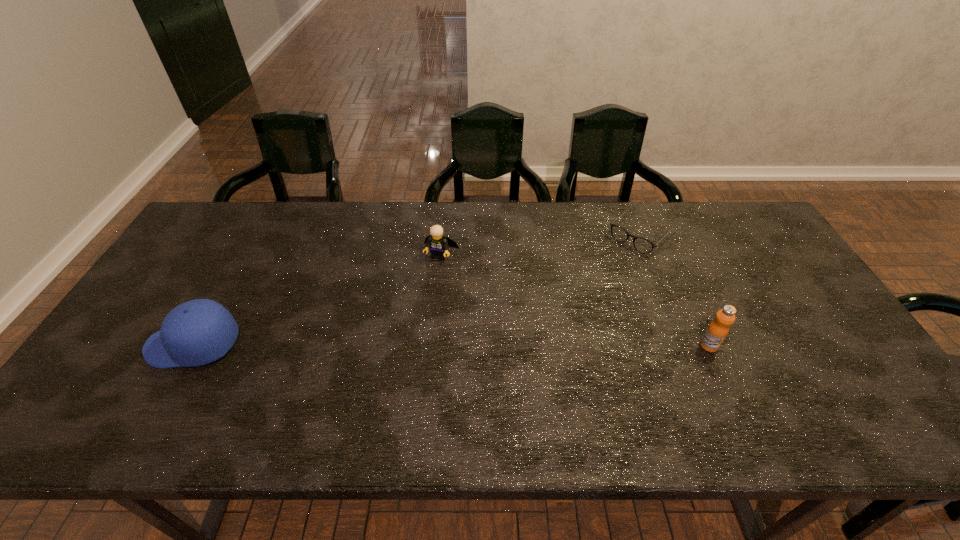
This screenshot has width=960, height=540. What are the coordinates of `vacant space on the desktop that is between the cap and the orange juice and is positioned through the lenses of the shortest object` in the screenshot? It's located at (523, 345).

Identify the location of free spot on the desktop that is between the cap and the orange juice and is positioned on the front-facing side of the second object from left to right. This screenshot has width=960, height=540. (402, 345).